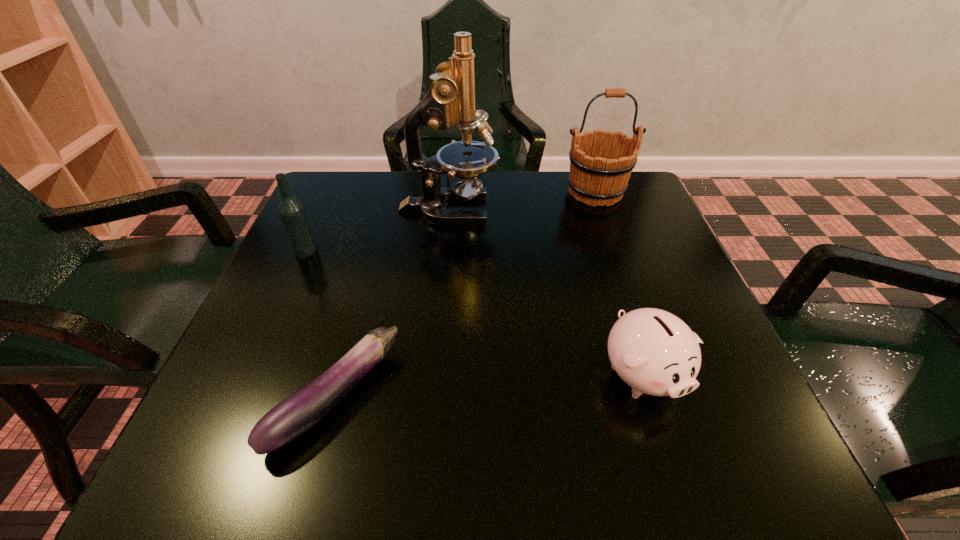
Locate an element on the screen. The height and width of the screenshot is (540, 960). microscope is located at coordinates (450, 100).

Where is `the second tallest object`? the second tallest object is located at coordinates (598, 176).

The image size is (960, 540). What are the coordinates of `vodka` in the screenshot? It's located at (292, 213).

Identify the location of the third shortest object. The image size is (960, 540). (292, 213).

Image resolution: width=960 pixels, height=540 pixels. Find the location of `piggy bank`. piggy bank is located at coordinates (653, 351).

The height and width of the screenshot is (540, 960). Identify the location of the shortest object. (293, 416).

This screenshot has height=540, width=960. I want to click on free space located at the eyepiece of the tallest object, so click(x=540, y=209).

I want to click on vacant space located 0.260m on the left of the wine bucket, so click(x=457, y=193).

Where is `free space located 0.290m on the right of the leftmost object`? The width and height of the screenshot is (960, 540). free space located 0.290m on the right of the leftmost object is located at coordinates (453, 251).

The width and height of the screenshot is (960, 540). Find the location of `vacant space located 0.240m on the back of the piggy bank`. vacant space located 0.240m on the back of the piggy bank is located at coordinates (602, 248).